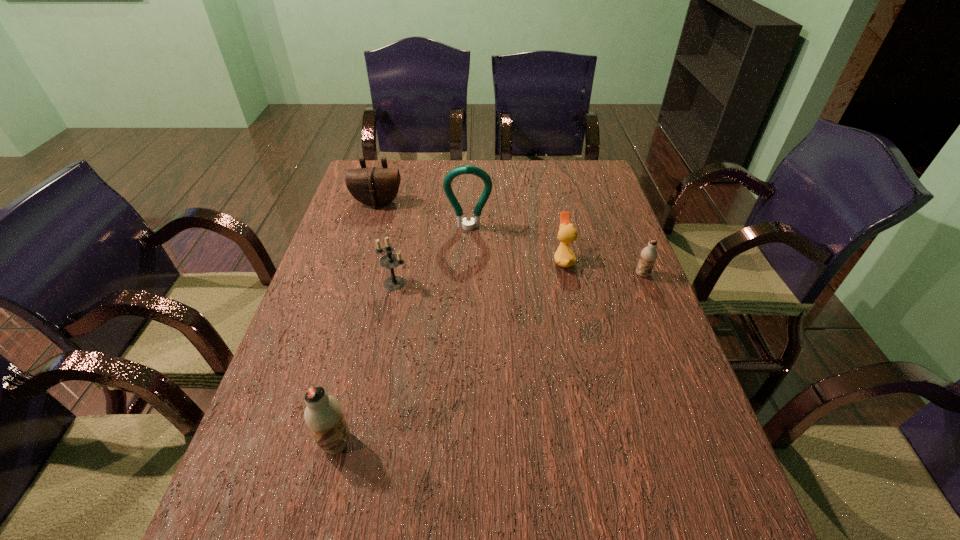
In order to click on vacant area located on the front of the farther chocolate milk in this screenshot , I will do `click(658, 312)`.

What are the coordinates of `vacant area situated at the jaws of the tallest object` in the screenshot? It's located at (468, 244).

The width and height of the screenshot is (960, 540). I want to click on vacant space situated on the right of the candle holder, so click(513, 283).

The width and height of the screenshot is (960, 540). Identify the location of vacant space located 0.230m with the flap open on the farthest object. (362, 256).

You are a GUI agent. You are given a task and a screenshot of the screen. Output one action in this format:
    pyautogui.click(x=<x>, y=<y>)
    Task: Click on the free location located on the beak of the fifth object from left to right
    
    Given the screenshot: What is the action you would take?
    pyautogui.click(x=476, y=260)

Locate an element on the screen. free space located 0.250m on the beak of the fifth object from left to right is located at coordinates (466, 260).

Locate an element on the screen. This screenshot has height=540, width=960. vacant space located 0.140m on the beak of the fifth object from left to right is located at coordinates (504, 260).

Image resolution: width=960 pixels, height=540 pixels. I want to click on object that is at the near edge, so click(x=323, y=414).

Locate an element on the screen. This screenshot has height=540, width=960. chocolate milk present at the left edge is located at coordinates point(323,414).

This screenshot has width=960, height=540. Find the location of `pouch that is at the left edge`. pouch that is at the left edge is located at coordinates (375, 187).